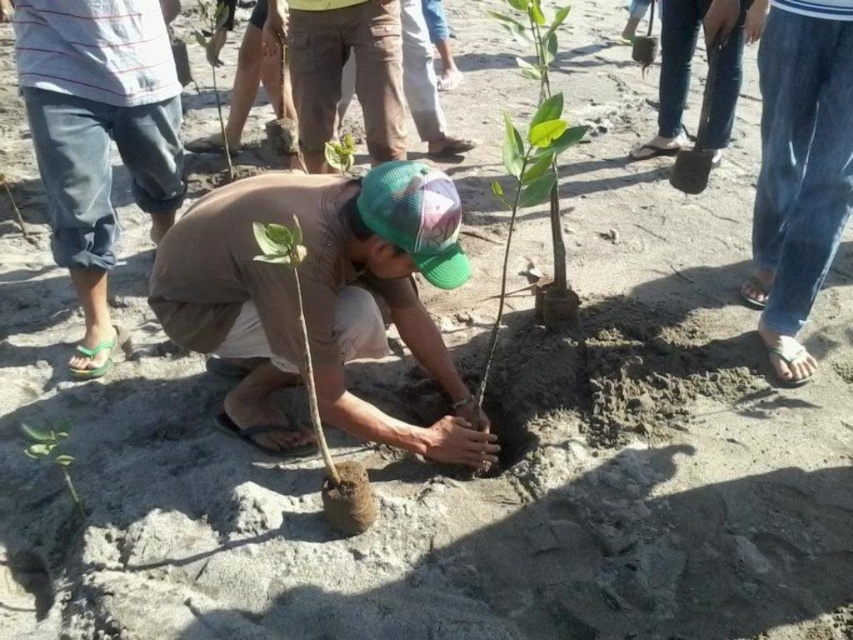
Does denim jeans at lower right have a larger size compared to green matte plant at lower left?

Correct, denim jeans at lower right is larger in size than green matte plant at lower left.

Is denim jeans at lower right further to camera compared to green matte plant at lower left?

Yes.

Is point (773, 362) in front of point (83, 502)?

No, it is behind (83, 502).

This screenshot has height=640, width=853. What are the coordinates of `denim jeans at lower right` in the screenshot? It's located at (799, 168).

Which of these two, denim jeans at lower right or jeans at center, stands taller?

denim jeans at lower right is taller.

Is denim jeans at lower right positioned in front of jeans at center?

Yes, denim jeans at lower right is closer to the viewer.

The height and width of the screenshot is (640, 853). What are the coordinates of `denim jeans at lower right` in the screenshot? It's located at (799, 168).

Which of these two, denim shorts at left or green matte plant at lower left, stands taller?

denim shorts at left

Based on the photo, who is higher up, denim shorts at left or green matte plant at lower left?

denim shorts at left is above.

Between point (157, 86) and point (25, 451), which one is positioned behind?

The point (157, 86) is more distant.

At what (x,y) coordinates should I click in order to perform the action: click on denim shorts at left. Please return your answer as a coordinate pair (x, y). The height and width of the screenshot is (640, 853). Looking at the image, I should click on (99, 132).